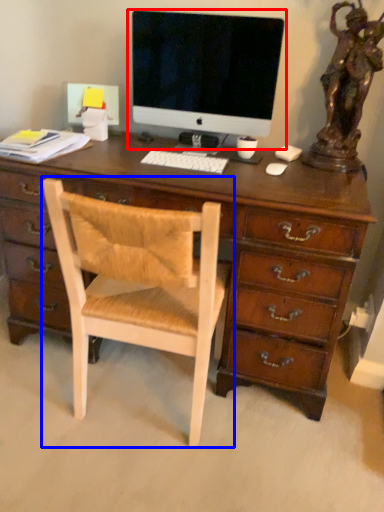
Question: Among these objects, which one is farthest to the camera, computer monitor (highlighted by a red box) or chair (highlighted by a blue box)?

Choices:
 (A) computer monitor
 (B) chair

Answer: (A)